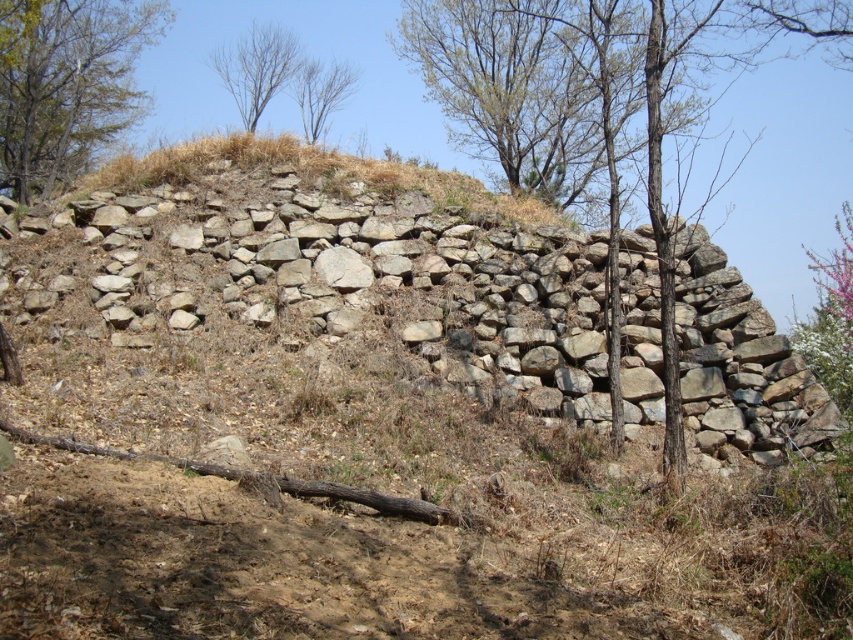
You are a painter standing at the base of the natural stone wall at center and want to paint the brown textured tree at upper left. Which object is wider in the image?

The natural stone wall at center might be wider than brown textured tree at upper left, so it is possible that the natural stone wall at center is wider.

You are standing in front of the natural stone wall at center. What are the coordinates of its center point?

The coordinates of the center point of the natural stone wall at center are at point (352, 273).